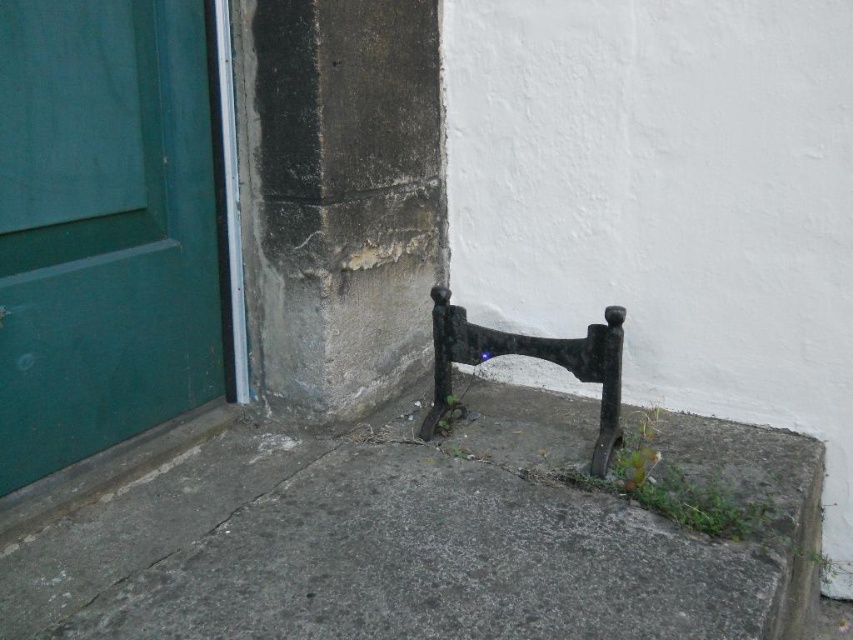
You are standing in front of the green door and want to place a small object on the step. You have two points marked on the step where you can place it. Which point, point (756, 582) or point (158, 308), is closer to you?

Point (756, 582) is closer to the viewer than point (158, 308), so you should place the object there if you want it nearer to you.

You are standing on the gray concrete pavement at lower center and want to enter the green matte door at left. Can you walk directly to the door from your current position?

Yes, because the gray concrete pavement at lower center is in front of the green matte door at left, so you can walk directly to the door from your current position.